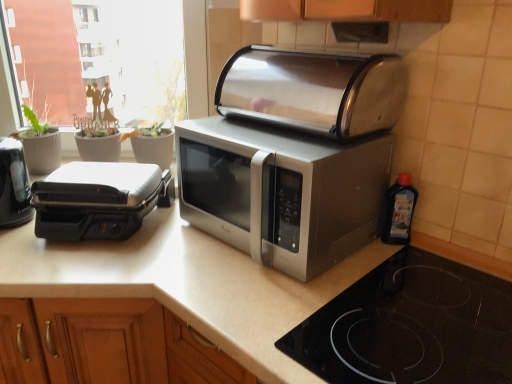
At what (x,y) coordinates should I click in order to perform the action: click on vacant area that is in front of transparent plastic bottle at right. Please return your answer as a coordinate pair (x, y). The height and width of the screenshot is (384, 512). Looking at the image, I should click on point(419,292).